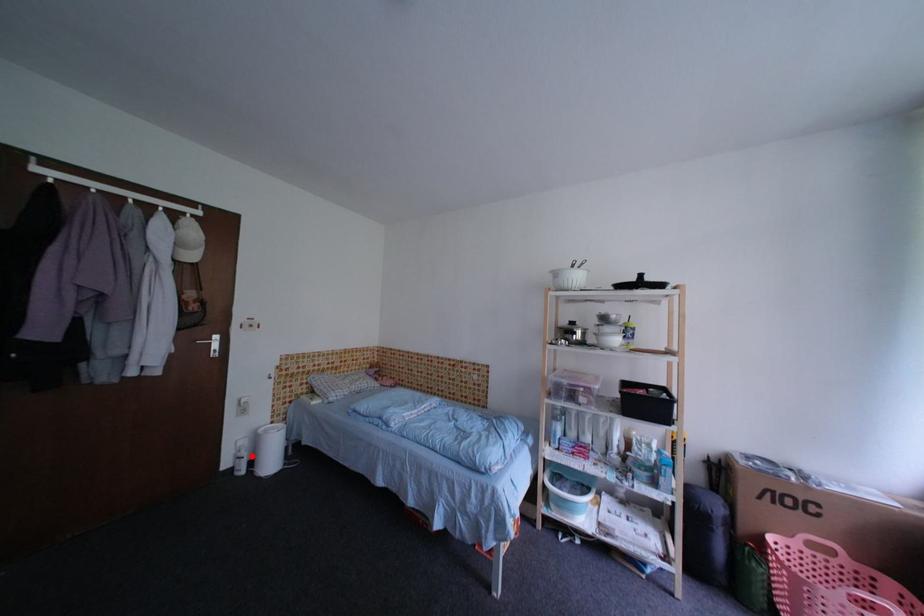
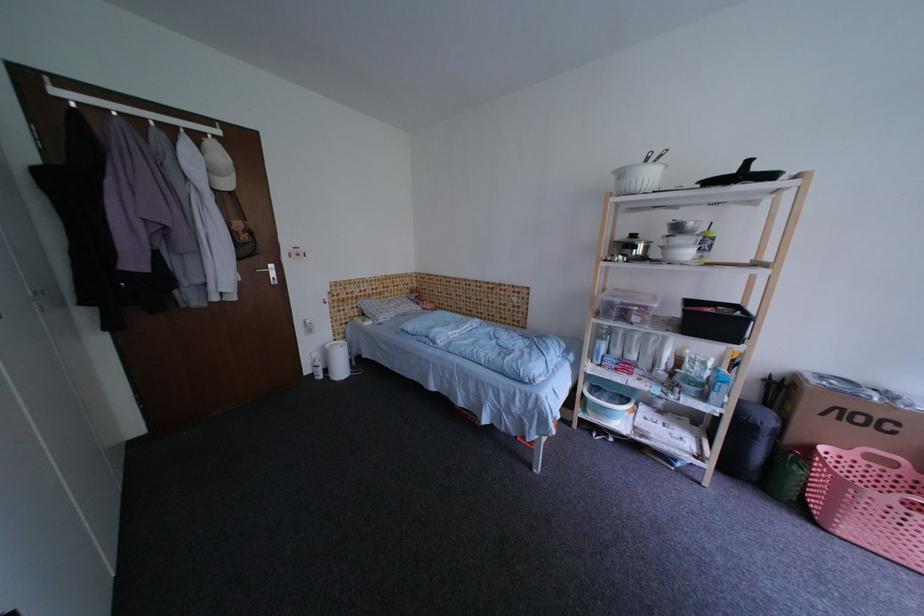
Locate, in the second image, the point that corresponds to the highlighted location in the first image.

(326, 366)